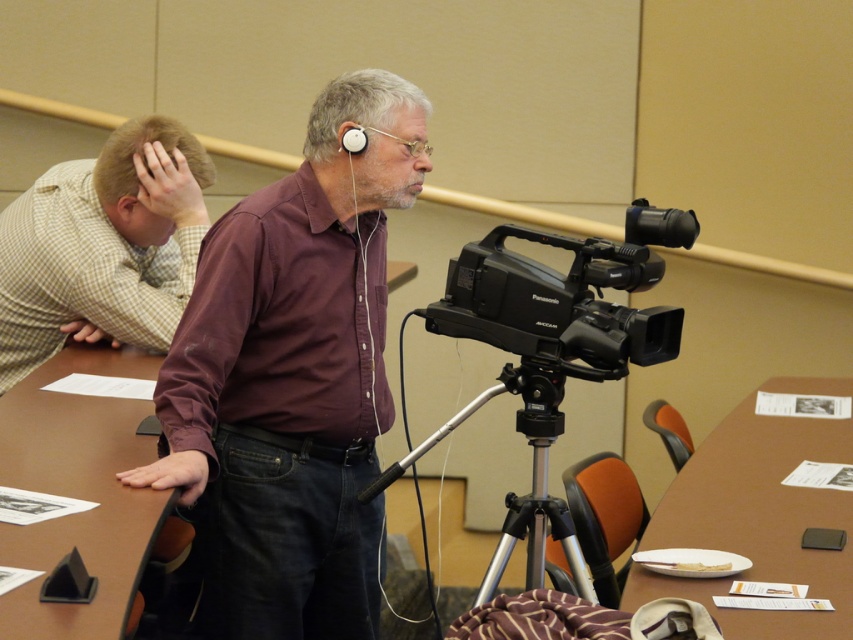
You are setting up a camera for a presentation. The black plastic camera at center is mounted on the silver metallic tripod at center. You need to adjust the height so that the camera points directly at the speaker standing 10 feet away. Given the current distance between the camera and tripod, can you estimate if the camera will be angled upwards or downwards to focus on the speaker?

The distance between the black plastic camera at center and silver metallic tripod at center is 9.27 inches. Since the camera is mounted on the tripod, the vertical angle adjustment depends on the tripod height and camera position. However, without knowing the tripod height or the speaker height, we cannot determine if the camera needs to angle upwards or downwards. Additional information about the setup is required.

You are standing at the center of the room and want to place a new plant pot on the brown wood table at lower right. According to the scene description, where exactly should you place the plant pot?

The brown wood table at lower right is located at point coordinates of (757,522), so you should place the plant pot there.

You are organizing a photo shoot and need to ensure that the maroon shirt at center and the black plastic camera at center are both visible in the frame. Given their sizes, which object should you prioritize positioning closer to the camera to maintain clarity and detail?

The maroon shirt at center is wider than the black plastic camera at center, so you should prioritize positioning the maroon shirt at center closer to the camera to ensure both objects are clearly visible in the frame.